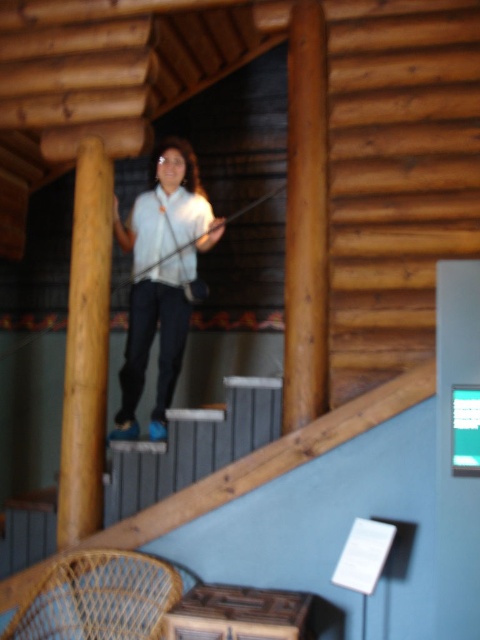
In the scene shown: Measure the distance from matte white shirt at center to white matte shirt at upper center.

matte white shirt at center is 3.23 inches from white matte shirt at upper center.

Does matte white shirt at center have a larger size compared to white matte shirt at upper center?

Yes.

Which is in front, point (181, 212) or point (139, 253)?

Positioned in front is point (181, 212).

Identify the location of matte white shirt at center. (162, 276).

Measure the distance from brown wood at left to white matte shirt at upper center.

17.25 inches

Who is higher up, brown wood at left or white matte shirt at upper center?

white matte shirt at upper center is above.

Is point (96, 401) positioned after point (182, 204)?

No, (96, 401) is in front of (182, 204).

I want to click on brown wood at left, so click(85, 348).

Is matte white shirt at center below brown wood at left?

No, matte white shirt at center is not below brown wood at left.

Which is more to the right, matte white shirt at center or brown wood at left?

matte white shirt at center is more to the right.

Between point (204, 225) and point (93, 166), which one is positioned behind?

Point (204, 225)

Where is `matte white shirt at center`? This screenshot has height=640, width=480. matte white shirt at center is located at coordinates (162, 276).